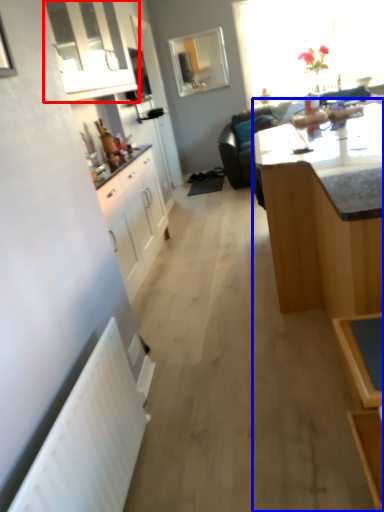
Question: Among these objects, which one is nearest to the camera, cabinetry (highlighted by a red box) or table (highlighted by a blue box)?

Choices:
 (A) cabinetry
 (B) table

Answer: (B)